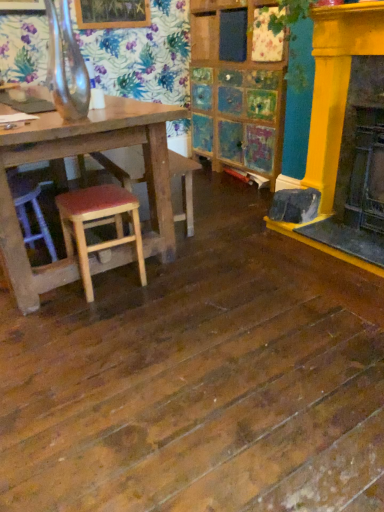
Question: Does wooden seat at center lie in front of wooden stool with red cushion at lower left?

Choices:
 (A) yes
 (B) no

Answer: (B)

Question: Does wooden seat at center appear on the right side of wooden stool with red cushion at lower left?

Choices:
 (A) no
 (B) yes

Answer: (A)

Question: Does wooden seat at center have a greater width compared to wooden stool with red cushion at lower left?

Choices:
 (A) no
 (B) yes

Answer: (B)

Question: Considering the relative sizes of wooden seat at center and wooden stool with red cushion at lower left in the image provided, is wooden seat at center smaller than wooden stool with red cushion at lower left?

Choices:
 (A) no
 (B) yes

Answer: (A)

Question: Is wooden stool with red cushion at lower left a part of wooden seat at center?

Choices:
 (A) yes
 (B) no

Answer: (B)

Question: From a real-world perspective, does wooden seat at center sit lower than wooden stool with red cushion at lower left?

Choices:
 (A) no
 (B) yes

Answer: (A)

Question: Does wooden stool with red cushion at lower left have a smaller size compared to wooden seat at center?

Choices:
 (A) yes
 (B) no

Answer: (A)

Question: Is wooden stool with red cushion at lower left behind wooden seat at center?

Choices:
 (A) yes
 (B) no

Answer: (B)

Question: Does wooden stool with red cushion at lower left have a larger size compared to wooden seat at center?

Choices:
 (A) no
 (B) yes

Answer: (A)

Question: Can you confirm if wooden stool with red cushion at lower left is thinner than wooden seat at center?

Choices:
 (A) yes
 (B) no

Answer: (A)

Question: Does wooden stool with red cushion at lower left have a lesser height compared to wooden seat at center?

Choices:
 (A) no
 (B) yes

Answer: (B)

Question: Is wooden stool with red cushion at lower left aimed at wooden seat at center?

Choices:
 (A) yes
 (B) no

Answer: (B)

Question: Is there a large distance between yellow painted wood fireplace at right and wooden seat at center?

Choices:
 (A) yes
 (B) no

Answer: (B)